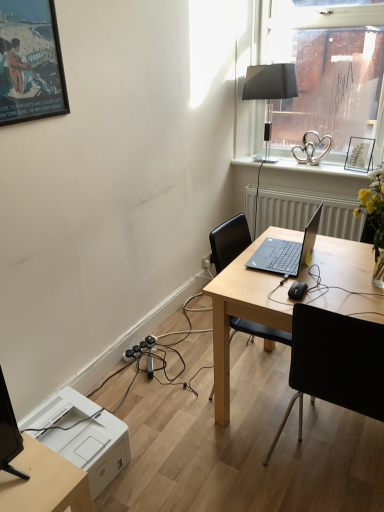
Where is `unoccupied area behind black plastic mouse at lower right`? unoccupied area behind black plastic mouse at lower right is located at coordinates (306, 273).